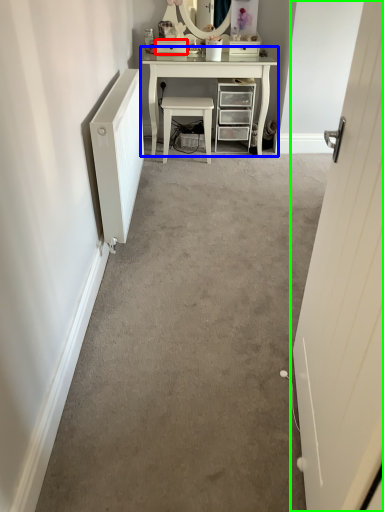
Question: Which object is positioned closest to drawer (highlighted by a red box)? Select from table (highlighted by a blue box) and door (highlighted by a green box).

Choices:
 (A) table
 (B) door

Answer: (A)